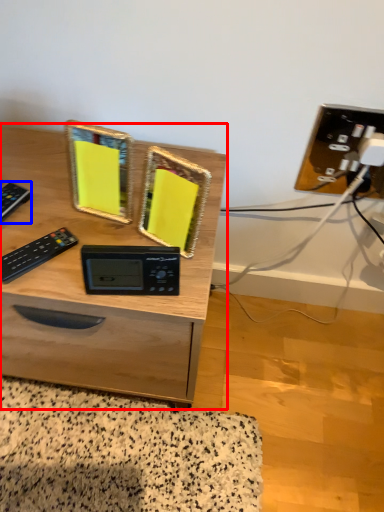
Question: Which point is closer to the camera, desk (highlighted by a red box) or control (highlighted by a blue box)?

Choices:
 (A) desk
 (B) control

Answer: (A)